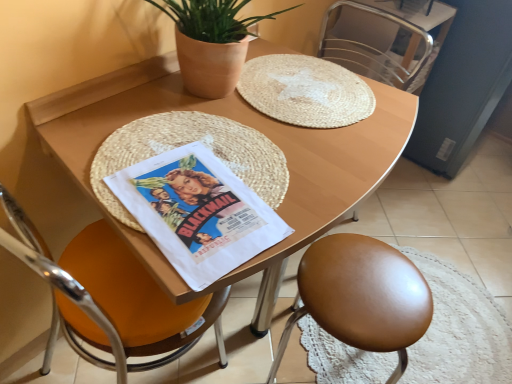
Where is `space that is in front of terracotta pot at upper center`? The image size is (512, 384). space that is in front of terracotta pot at upper center is located at coordinates (187, 140).